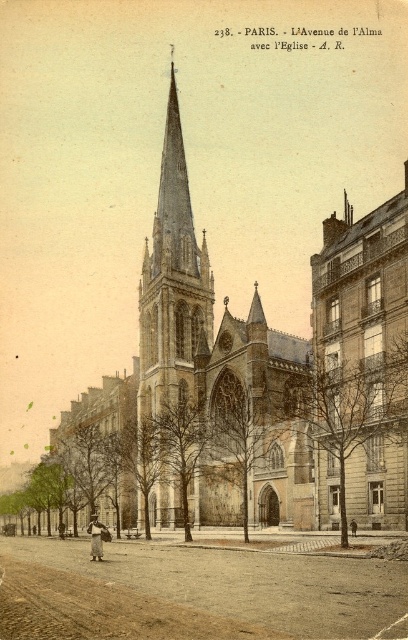
Question: Does brown stone church at center lie behind stone gothic tower at center?

Choices:
 (A) yes
 (B) no

Answer: (B)

Question: Which point is farther to the camera?

Choices:
 (A) (137, 413)
 (B) (173, 90)

Answer: (B)

Question: Which point is farther to the camera?

Choices:
 (A) (150, 323)
 (B) (153, 300)

Answer: (A)

Question: Can you confirm if brown stone church at center is smaller than stone gothic tower at center?

Choices:
 (A) yes
 (B) no

Answer: (B)

Question: Is brown stone church at center positioned before stone gothic tower at center?

Choices:
 (A) yes
 (B) no

Answer: (A)

Question: Among these points, which one is nearest to the camera?

Choices:
 (A) (141, 360)
 (B) (346, 337)

Answer: (B)